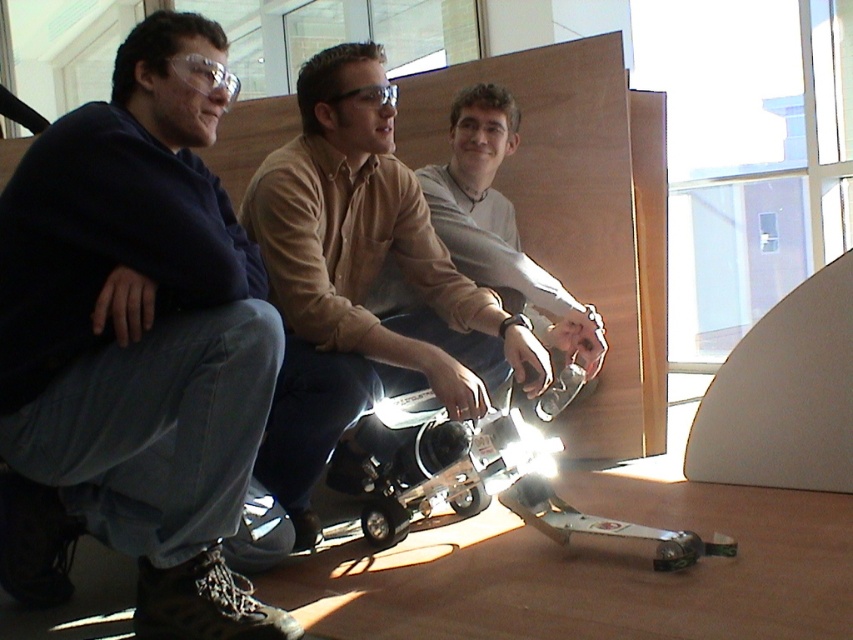
Question: Can you confirm if matte black jacket at left is bigger than metallic silver drone at center?

Choices:
 (A) yes
 (B) no

Answer: (A)

Question: Which point is closer to the camera?

Choices:
 (A) matte black jacket at left
 (B) light gray shirt at center
 (C) metallic silver drone at center
 (D) matte brown shirt at center

Answer: (A)

Question: Is matte black jacket at left above matte brown shirt at center?

Choices:
 (A) no
 (B) yes

Answer: (A)

Question: Which point appears closest to the camera in this image?

Choices:
 (A) (450, 202)
 (B) (363, 113)

Answer: (B)

Question: Which point is closer to the camera?

Choices:
 (A) (476, 291)
 (B) (642, 534)

Answer: (B)

Question: Can you confirm if metallic silver drone at center is positioned above light gray shirt at center?

Choices:
 (A) no
 (B) yes

Answer: (A)